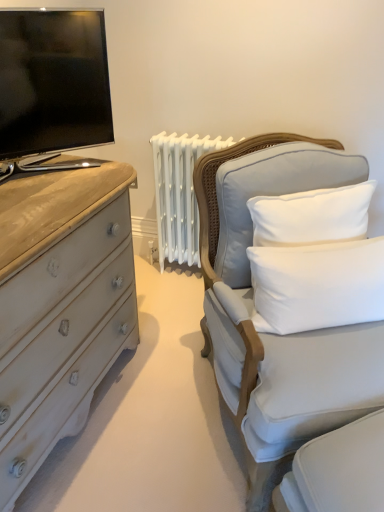
In order to face white soft cushion at right, arranged as the 1th pillow when ordered from the bottom, should I rotate leftwards or rightwards?

It's best to rotate right around 18.510 degrees.

The width and height of the screenshot is (384, 512). Identify the location of light gray fabric chair at right. (252, 307).

What are the coordinates of `matte black screen at upper left` in the screenshot? It's located at (53, 81).

Locate an element on the screen. This screenshot has height=512, width=384. white soft cushion at right, the second pillow when ordered from top to bottom is located at coordinates (318, 285).

Is white cotton pillow at upper right, the 2th pillow ordered from the bottom, thinner than light gray fabric chair at right?

Correct, the width of white cotton pillow at upper right, the 2th pillow ordered from the bottom, is less than that of light gray fabric chair at right.

From a real-world perspective, who is located lower, white cotton pillow at upper right, the 2th pillow ordered from the bottom, or light gray fabric chair at right?

From a 3D spatial view, light gray fabric chair at right is below.

In the scene shown: Between white cotton pillow at upper right, the 1th pillow positioned from the top, and light gray fabric chair at right, which one has larger size?

light gray fabric chair at right.

How different are the orientations of white cotton pillow at upper right, the 1th pillow positioned from the top, and light gray fabric chair at right in degrees?

They differ by 0.0594 degrees in their facing directions.

Would you consider light gray fabric chair at right to be distant from white soft cushion at right, arranged as the 1th pillow when ordered from the bottom?

No, there isn't a large distance between light gray fabric chair at right and white soft cushion at right, arranged as the 1th pillow when ordered from the bottom.

Where is `furniture located underneath the white soft cushion at right, arranged as the 1th pillow when ordered from the bottom (from a real-world perspective)`? Image resolution: width=384 pixels, height=512 pixels. furniture located underneath the white soft cushion at right, arranged as the 1th pillow when ordered from the bottom (from a real-world perspective) is located at coordinates (252, 307).

Could you measure the distance between light gray fabric chair at right and white soft cushion at right, the second pillow when ordered from top to bottom?

light gray fabric chair at right and white soft cushion at right, the second pillow when ordered from top to bottom, are 7.64 inches apart from each other.

Which of these two, light gray fabric chair at right or matte black screen at upper left, is smaller?

matte black screen at upper left is smaller.

In the scene shown: From the image's perspective, would you say light gray fabric chair at right is positioned over matte black screen at upper left?

Actually, light gray fabric chair at right appears below matte black screen at upper left in the image.

Between light gray fabric chair at right and matte black screen at upper left, which one has larger width?

Wider between the two is light gray fabric chair at right.

From a real-world perspective, is light gray fabric chair at right physically below matte black screen at upper left?

Yes, from a real-world perspective, light gray fabric chair at right is beneath matte black screen at upper left.

Between point (273, 293) and point (301, 169), which one is positioned in front?

The point (273, 293) is closer.

Locate an element on the screen. Image resolution: width=384 pixels, height=512 pixels. pillow lying on the right of white cotton pillow at upper right, the 1th pillow positioned from the top is located at coordinates (318, 285).

Is white soft cushion at right, the second pillow when ordered from top to bottom, thinner than white cotton pillow at upper right, the 2th pillow ordered from the bottom?

Yes, white soft cushion at right, the second pillow when ordered from top to bottom, is thinner than white cotton pillow at upper right, the 2th pillow ordered from the bottom.

Is white cotton pillow at upper right, the 2th pillow ordered from the bottom, located within white soft cushion at right, arranged as the 1th pillow when ordered from the bottom?

No, white soft cushion at right, arranged as the 1th pillow when ordered from the bottom, does not contain white cotton pillow at upper right, the 2th pillow ordered from the bottom.

Does white cotton pillow at upper right, the 2th pillow ordered from the bottom, have a lesser width compared to matte black screen at upper left?

Yes.

Are white cotton pillow at upper right, the 1th pillow positioned from the top, and matte black screen at upper left far apart?

They are positioned close to each other.

Considering the relative sizes of white cotton pillow at upper right, the 2th pillow ordered from the bottom, and matte black screen at upper left in the image provided, is white cotton pillow at upper right, the 2th pillow ordered from the bottom, shorter than matte black screen at upper left?

Correct, white cotton pillow at upper right, the 2th pillow ordered from the bottom, is not as tall as matte black screen at upper left.

Based on the photo, from the image's perspective, is white cotton pillow at upper right, the 2th pillow ordered from the bottom, beneath matte black screen at upper left?

Indeed, from the image's perspective, white cotton pillow at upper right, the 2th pillow ordered from the bottom, is shown beneath matte black screen at upper left.

From the image's perspective, is white soft cushion at right, arranged as the 1th pillow when ordered from the bottom, located above matte black screen at upper left?

No.

Considering the relative sizes of white soft cushion at right, the second pillow when ordered from top to bottom, and matte black screen at upper left in the image provided, is white soft cushion at right, the second pillow when ordered from top to bottom, wider than matte black screen at upper left?

Incorrect, the width of white soft cushion at right, the second pillow when ordered from top to bottom, does not surpass that of matte black screen at upper left.

Considering the positions of points (303, 259) and (36, 82), is point (303, 259) farther from camera compared to point (36, 82)?

That is False.

From a real-world perspective, is white soft cushion at right, the second pillow when ordered from top to bottom, above or below matte black screen at upper left?

From a real-world perspective, white soft cushion at right, the second pillow when ordered from top to bottom, is physically below matte black screen at upper left.

Between matte black screen at upper left and white soft cushion at right, arranged as the 1th pillow when ordered from the bottom, which one has larger size?

With larger size is matte black screen at upper left.

Is the surface of matte black screen at upper left in direct contact with white soft cushion at right, arranged as the 1th pillow when ordered from the bottom?

No, matte black screen at upper left is not next to white soft cushion at right, arranged as the 1th pillow when ordered from the bottom.

Can you confirm if matte black screen at upper left is positioned to the left of white soft cushion at right, the second pillow when ordered from top to bottom?

Yes, matte black screen at upper left is to the left of white soft cushion at right, the second pillow when ordered from top to bottom.

This screenshot has height=512, width=384. What are the coordinates of `the 2nd pillow directly above the light gray fabric chair at right (from a real-world perspective)` in the screenshot? It's located at (272, 193).

What are the coordinates of `furniture in front of the white soft cushion at right, the second pillow when ordered from top to bottom` in the screenshot? It's located at (252, 307).

From the image, which object appears to be farther from light gray fabric chair at right, matte black screen at upper left or white cotton pillow at upper right, the 1th pillow positioned from the top?

matte black screen at upper left is further to light gray fabric chair at right.

Looking at the image, which one is located closer to light gray fabric chair at right, white cotton pillow at upper right, the 1th pillow positioned from the top, or white soft cushion at right, the second pillow when ordered from top to bottom?

white cotton pillow at upper right, the 1th pillow positioned from the top, is closer to light gray fabric chair at right.

Estimate the real-world distances between objects in this image. Which object is further from white cotton pillow at upper right, the 2th pillow ordered from the bottom, white soft cushion at right, arranged as the 1th pillow when ordered from the bottom, or light gray fabric chair at right?

The object further to white cotton pillow at upper right, the 2th pillow ordered from the bottom, is white soft cushion at right, arranged as the 1th pillow when ordered from the bottom.

Considering their positions, is white cotton pillow at upper right, the 1th pillow positioned from the top, positioned further to matte black screen at upper left than light gray fabric chair at right?

Among the two, light gray fabric chair at right is located further to matte black screen at upper left.

Estimate the real-world distances between objects in this image. Which object is further from white cotton pillow at upper right, the 2th pillow ordered from the bottom, matte black screen at upper left or light gray fabric chair at right?

The object further to white cotton pillow at upper right, the 2th pillow ordered from the bottom, is matte black screen at upper left.

Based on their spatial positions, is matte black screen at upper left or white soft cushion at right, arranged as the 1th pillow when ordered from the bottom, further from white cotton pillow at upper right, the 1th pillow positioned from the top?

Among the two, matte black screen at upper left is located further to white cotton pillow at upper right, the 1th pillow positioned from the top.

Which object lies further to the anchor point light gray fabric chair at right, white soft cushion at right, arranged as the 1th pillow when ordered from the bottom, or white cotton pillow at upper right, the 2th pillow ordered from the bottom?

white soft cushion at right, arranged as the 1th pillow when ordered from the bottom, is further to light gray fabric chair at right.

Looking at the image, which one is located further to matte black screen at upper left, white soft cushion at right, the second pillow when ordered from top to bottom, or light gray fabric chair at right?

Among the two, white soft cushion at right, the second pillow when ordered from top to bottom, is located further to matte black screen at upper left.

Locate an element on the screen. This screenshot has width=384, height=512. pillow between light gray fabric chair at right and white cotton pillow at upper right, the 1th pillow positioned from the top, in the front-back direction is located at coordinates (318, 285).

Where is `furniture located between matte black screen at upper left and white soft cushion at right, arranged as the 1th pillow when ordered from the bottom, in the left-right direction`? The height and width of the screenshot is (512, 384). furniture located between matte black screen at upper left and white soft cushion at right, arranged as the 1th pillow when ordered from the bottom, in the left-right direction is located at coordinates (252, 307).

The image size is (384, 512). Find the location of `pillow situated between matte black screen at upper left and white soft cushion at right, arranged as the 1th pillow when ordered from the bottom, from left to right`. pillow situated between matte black screen at upper left and white soft cushion at right, arranged as the 1th pillow when ordered from the bottom, from left to right is located at coordinates (272, 193).

In order to click on furniture between matte black screen at upper left and white cotton pillow at upper right, the 1th pillow positioned from the top in this screenshot , I will do `click(252, 307)`.